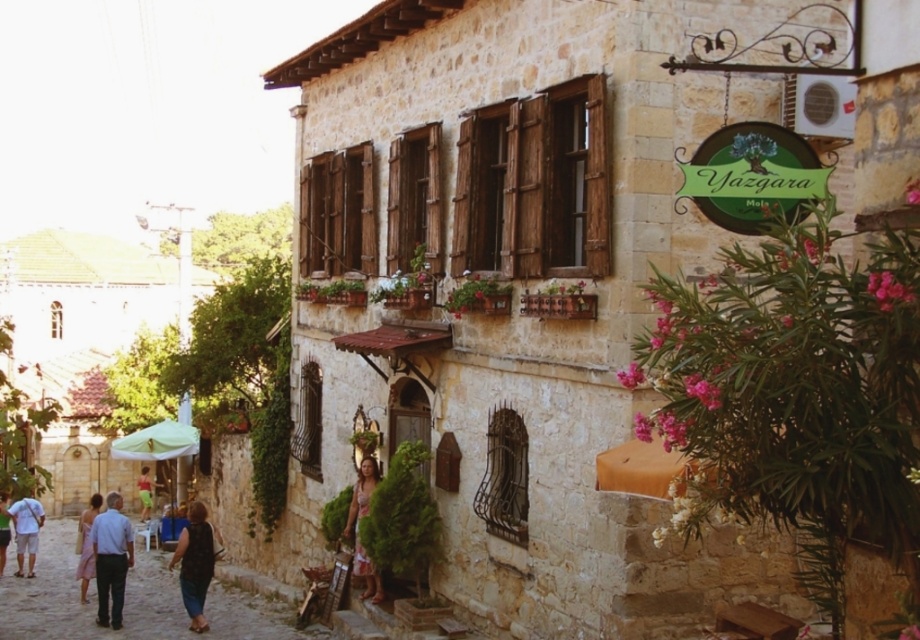
Does smooth stone alley at lower left come in front of dark blue denim jeans at lower left?

Yes, it is.

Where is `smooth stone alley at lower left`? This screenshot has height=640, width=920. smooth stone alley at lower left is located at coordinates (128, 602).

From the picture: Is white cotton shorts at lower left below light blue jeans at lower left?

Yes.

Can you confirm if white cotton shorts at lower left is positioned to the left of light blue jeans at lower left?

No, white cotton shorts at lower left is not to the left of light blue jeans at lower left.

Is point (16, 561) more distant than point (0, 547)?

That is True.

At what (x,y) coordinates should I click in order to perform the action: click on white cotton shorts at lower left. Please return your answer as a coordinate pair (x, y). The image size is (920, 640). Looking at the image, I should click on (26, 531).

Does smooth stone alley at lower left appear on the right side of light blue jeans at lower left?

Indeed, smooth stone alley at lower left is positioned on the right side of light blue jeans at lower left.

Who is more distant from viewer, (138, 547) or (1, 572)?

The point (138, 547) is behind.

What do you see at coordinates (128, 602) in the screenshot? This screenshot has width=920, height=640. I see `smooth stone alley at lower left` at bounding box center [128, 602].

Identify the location of smooth stone alley at lower left. (128, 602).